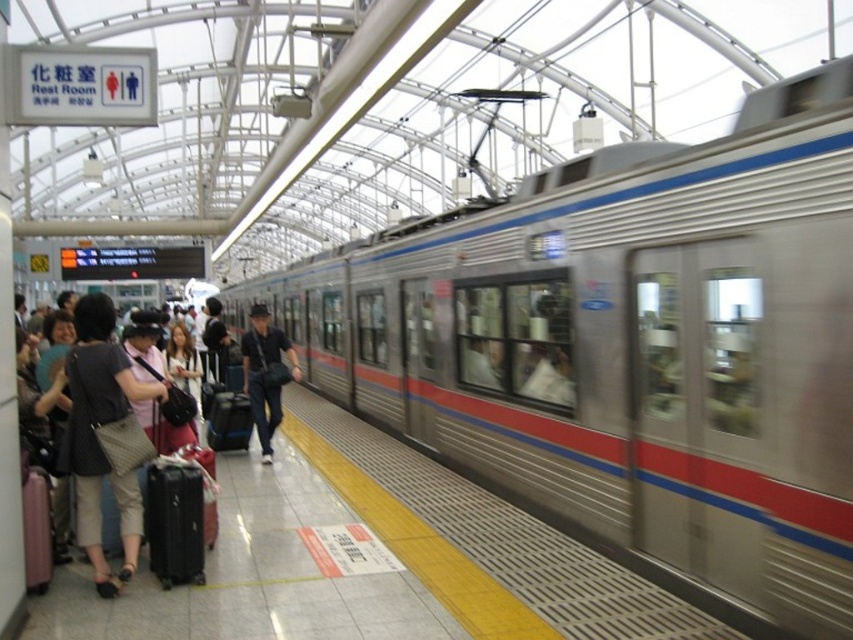
You are a passenger waiting at the train station platform. You see a silver metallic train at center and a matte pink suitcase at lower left. Which object is closer to the edge of the platform marked by the yellow tactile strip?

The matte pink suitcase at lower left is closer to the edge of the platform marked by the yellow tactile strip because it is positioned to the left of the silver metallic train at center, which is further away from the edge.

You are standing at the point marked by the coordinates point (630, 346). Looking around the train station platform, what object is located exactly at your current position?

The point (630, 346) corresponds to the silver metallic train at center.